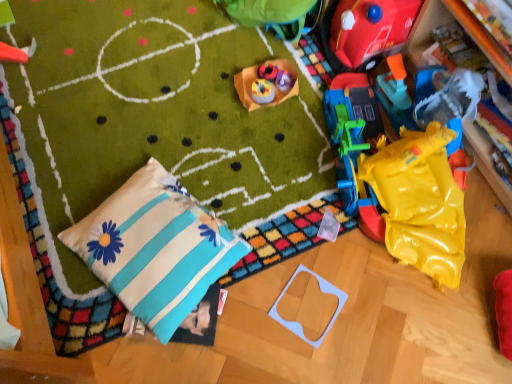
Question: From a real-world perspective, is rubberized red toy at upper left, positioned as the 4th toy in bottom-to-top order, positioned above or below matte plastic toy at center, placed as the 5th toy when sorted from right to left?

Choices:
 (A) above
 (B) below

Answer: (A)

Question: Is rubberized red toy at upper left, which ranks as the sixth toy in right-to-left order, inside the boundaries of matte plastic toy at center, placed as the 5th toy when sorted from right to left, or outside?

Choices:
 (A) inside
 (B) outside

Answer: (B)

Question: Estimate the real-world distances between objects in this image. Which object is farther from the yellow rubber at right?

Choices:
 (A) cotton/pillow at lower left
 (B) light blue plastic frame at lower center, placed as the fifth toy when sorted from left to right
 (C) matte plastic toy at center, placed as the 5th toy when sorted from right to left
 (D) matte plastic toy at center, which is the fourth toy in top-to-bottom order
 (E) rubberized red toy at upper left, which ranks as the sixth toy in right-to-left order

Answer: (E)

Question: Based on their relative distances, which object is nearer to the cotton/pillow at lower left?

Choices:
 (A) green fabric tent at upper center, arranged as the sixth toy when ordered from the bottom
 (B) light blue plastic frame at lower center, which is the second toy from right to left
 (C) matte plastic toy at center, positioned as the fourth toy in right-to-left order
 (D) rubberized red car at upper right, which is the fifth toy in bottom-to-top order
 (E) yellow rubber at right

Answer: (B)